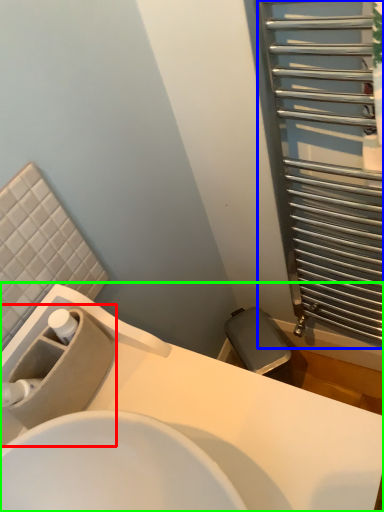
Question: Based on their relative distances, which object is farther from sink (highlighted by a red box)? Choose from screen door (highlighted by a blue box) and sink (highlighted by a green box).

Choices:
 (A) screen door
 (B) sink

Answer: (A)